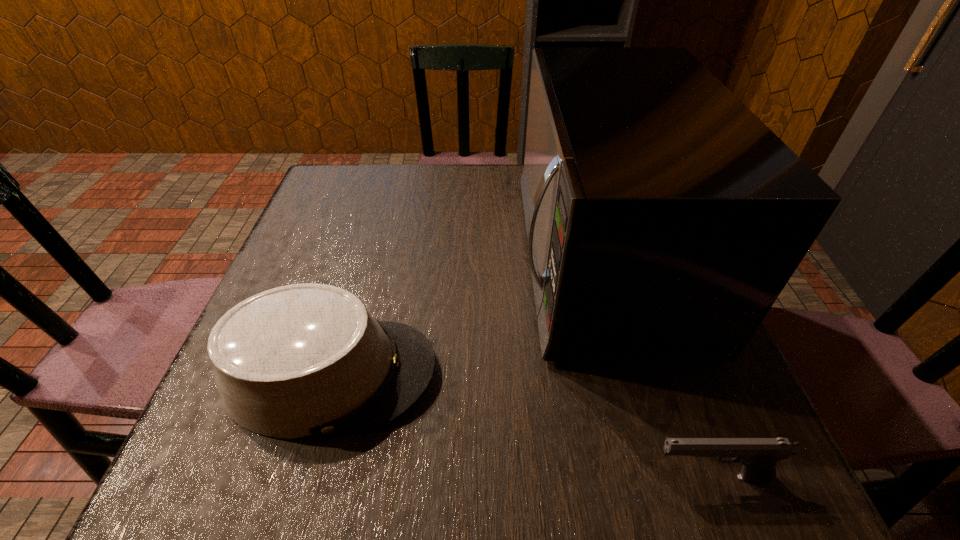
Locate an element on the screen. object situated at the far edge is located at coordinates (664, 218).

The image size is (960, 540). Find the location of `hat at the near edge`. hat at the near edge is located at coordinates (302, 360).

You are a GUI agent. You are given a task and a screenshot of the screen. Output one action in this format:
    pyautogui.click(x=<x>, y=<y>)
    Task: Click on the pistol that is at the near edge
    This screenshot has height=540, width=960.
    Given the screenshot: What is the action you would take?
    pyautogui.click(x=759, y=456)

What are the coordinates of `object at the left edge` in the screenshot? It's located at (302, 360).

Identify the location of microwave oven located in the right edge section of the desktop. (664, 218).

Where is `pistol present at the right edge`? pistol present at the right edge is located at coordinates (759, 456).

Find the location of a particular element. This screenshot has width=960, height=540. object positioned at the near left corner is located at coordinates (302, 360).

Find the location of `object that is at the far right corner`. object that is at the far right corner is located at coordinates (664, 218).

I want to click on object present at the near right corner, so click(759, 456).

What are the coordinates of `free location at the far edge` in the screenshot? It's located at (394, 187).